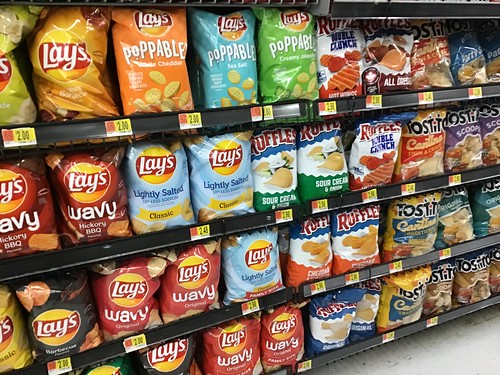
The width and height of the screenshot is (500, 375). I want to click on snacks on top shelf, so click(x=22, y=95), click(x=73, y=78), click(x=155, y=71), click(x=229, y=68), click(x=283, y=60), click(x=343, y=62), click(x=383, y=58), click(x=430, y=59), click(x=461, y=68), click(x=487, y=60).